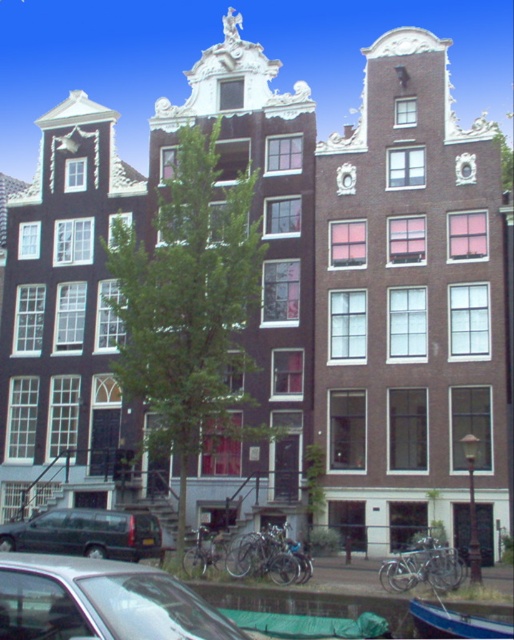
Is the position of shiny silver car at lower left less distant than that of blue painted wood boat at lower right?

Yes, shiny silver car at lower left is in front of blue painted wood boat at lower right.

Between point (130, 616) and point (411, 609), which one is positioned behind?

The point (411, 609) is behind.

Which is in front, point (144, 604) or point (415, 605)?

Positioned in front is point (144, 604).

This screenshot has height=640, width=514. Identify the location of shiny silver car at lower left. (100, 602).

Is shiny silver car at lower left shorter than silver metallic bicycle at center?

Incorrect, shiny silver car at lower left's height does not fall short of silver metallic bicycle at center's.

Is shiny silver car at lower left closer to camera compared to silver metallic bicycle at center?

Yes.

Who is more forward, (138, 570) or (388, 589)?

Point (138, 570) is in front.

Where is `shiny silver car at lower left`? This screenshot has width=514, height=640. shiny silver car at lower left is located at coordinates (100, 602).

Is the position of silver metallic bicycle at lower center more distant than that of silver metallic bicycle at center?

Yes.

Does point (260, 552) come in front of point (405, 557)?

No, (260, 552) is further to viewer.

I want to click on silver metallic bicycle at lower center, so click(x=268, y=556).